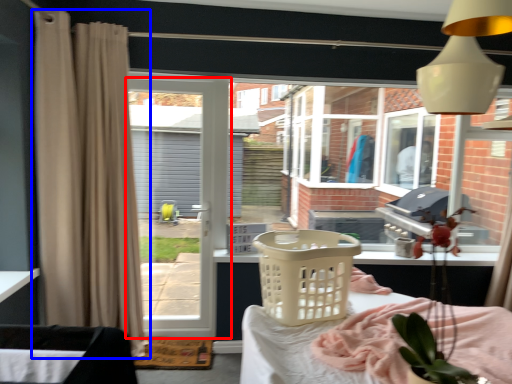
Question: Which of the following is the closest to the observer, door (highlighted by a red box) or curtain (highlighted by a blue box)?

Choices:
 (A) door
 (B) curtain

Answer: (B)